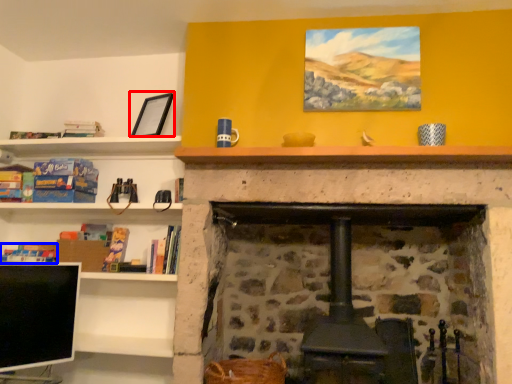
Question: Which of the following is the closest to the observer, picture frame (highlighted by a red box) or book (highlighted by a blue box)?

Choices:
 (A) picture frame
 (B) book

Answer: (A)